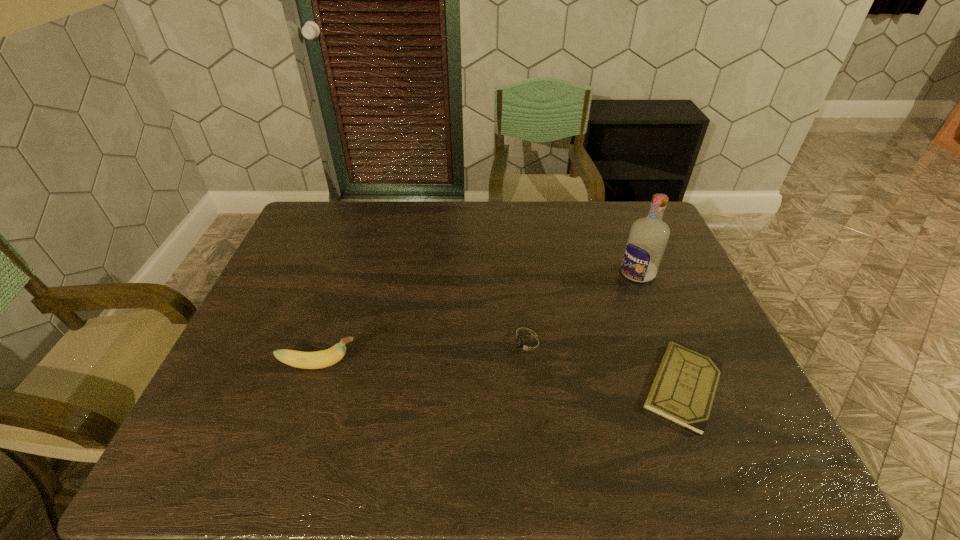
Locate an element on the screen. The width and height of the screenshot is (960, 540). free spot located on the face of the watch is located at coordinates (484, 361).

Find the location of a particular element. This screenshot has width=960, height=540. vacant space situated 0.180m on the face of the watch is located at coordinates (439, 379).

At what (x,y) coordinates should I click in order to perform the action: click on vacant area situated on the label of the tallest object. Please return your answer as a coordinate pair (x, y). This screenshot has width=960, height=540. Looking at the image, I should click on (578, 323).

At what (x,y) coordinates should I click in order to perform the action: click on free space located 0.070m on the label of the tallest object. Please return your answer as a coordinate pair (x, y). The width and height of the screenshot is (960, 540). Looking at the image, I should click on (613, 293).

Where is `free space located on the label of the tallest object`? free space located on the label of the tallest object is located at coordinates (561, 337).

Where is `object present at the near edge`? The height and width of the screenshot is (540, 960). object present at the near edge is located at coordinates (683, 390).

The image size is (960, 540). I want to click on object that is at the left edge, so click(318, 359).

Where is `checkbook that is positioned at the right edge`? The height and width of the screenshot is (540, 960). checkbook that is positioned at the right edge is located at coordinates (683, 390).

What are the coordinates of `vodka positioned at the right edge` in the screenshot? It's located at (646, 243).

I want to click on object situated at the near right corner, so click(x=683, y=390).